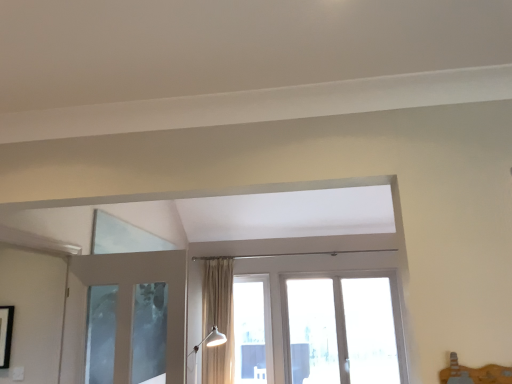
Where is `white glossy floor lamp at lower center`? This screenshot has width=512, height=384. white glossy floor lamp at lower center is located at coordinates (211, 340).

The width and height of the screenshot is (512, 384). What do you see at coordinates (211, 340) in the screenshot?
I see `white glossy floor lamp at lower center` at bounding box center [211, 340].

You are a GUI agent. You are given a task and a screenshot of the screen. Output one action in this format:
    pyautogui.click(x=<x>, y=<y>)
    Task: Click on the clear glass window at center
    
    Given the screenshot: What is the action you would take?
    pyautogui.click(x=253, y=329)

At what (x,y) coordinates should I click in order to perform the action: click on beige fabric curtain at center. Please return your answer as a coordinate pair (x, y). Looking at the image, I should click on (218, 320).

Which of these two, clear glass window at center or white glossy floor lamp at lower center, is wider?

With larger width is white glossy floor lamp at lower center.

Is clear glass window at center surrounding white glossy floor lamp at lower center?

Definitely not — white glossy floor lamp at lower center is not inside clear glass window at center.

Looking at this image, is clear glass window at center not near white glossy floor lamp at lower center?

Yes, clear glass window at center is far from white glossy floor lamp at lower center.

From the image's perspective, is white glossy floor lamp at lower center over clear glass window at center?

No, from the image's perspective, white glossy floor lamp at lower center is not over clear glass window at center.

What's the angular difference between white glossy floor lamp at lower center and clear glass window at center's facing directions?

The angular difference between white glossy floor lamp at lower center and clear glass window at center is 42.6 degrees.

Considering the sizes of white glossy floor lamp at lower center and clear glass window at center in the image, is white glossy floor lamp at lower center bigger or smaller than clear glass window at center?

Considering their sizes, white glossy floor lamp at lower center takes up more space than clear glass window at center.

Is white glossy floor lamp at lower center completely or partially outside of clear glass window at center?

Yes, white glossy floor lamp at lower center is outside of clear glass window at center.

Does beige fabric curtain at center have a greater width compared to white glossy floor lamp at lower center?

No.

Choose the correct answer: Is beige fabric curtain at center inside white glossy floor lamp at lower center or outside it?

beige fabric curtain at center is not inside white glossy floor lamp at lower center, it's outside.

Looking at this image, from the image's perspective, is beige fabric curtain at center on top of white glossy floor lamp at lower center?

Indeed, from the image's perspective, beige fabric curtain at center is shown above white glossy floor lamp at lower center.

Is beige fabric curtain at center further to the viewer compared to white glossy floor lamp at lower center?

Yes, beige fabric curtain at center is further from the camera.

In the scene shown: From a real-world perspective, which is physically below, beige fabric curtain at center or clear glass window at center?

In real-world perspective, clear glass window at center is lower.

Is beige fabric curtain at center touching clear glass window at center?

No, beige fabric curtain at center is not beside clear glass window at center.

Is beige fabric curtain at center positioned in front of clear glass window at center?

That is True.

Is beige fabric curtain at center looking in the opposite direction of clear glass window at center?

beige fabric curtain at center does not have its back to clear glass window at center.

Between white glossy floor lamp at lower center and beige fabric curtain at center, which one has larger size?

Bigger between the two is beige fabric curtain at center.

From the image's perspective, is white glossy floor lamp at lower center over beige fabric curtain at center?

No, from the image's perspective, white glossy floor lamp at lower center is not above beige fabric curtain at center.

From a real-world perspective, who is located lower, white glossy floor lamp at lower center or beige fabric curtain at center?

From a 3D spatial view, white glossy floor lamp at lower center is below.

Is white glossy floor lamp at lower center shorter than beige fabric curtain at center?

Indeed, white glossy floor lamp at lower center has a lesser height compared to beige fabric curtain at center.

Looking at their sizes, would you say clear glass window at center is wider or thinner than beige fabric curtain at center?

In the image, clear glass window at center appears to be more narrow than beige fabric curtain at center.

Which object is more forward, clear glass window at center or beige fabric curtain at center?

beige fabric curtain at center is more forward.

Is clear glass window at center to the left of beige fabric curtain at center from the viewer's perspective?

Incorrect, clear glass window at center is not on the left side of beige fabric curtain at center.

Locate an element on the screen. window behind the white glossy floor lamp at lower center is located at coordinates (253, 329).

Find the location of a particular element. Image resolution: width=512 pixels, height=384 pixels. window above the white glossy floor lamp at lower center (from a real-world perspective) is located at coordinates (253, 329).

Based on their spatial positions, is white glossy floor lamp at lower center or beige fabric curtain at center closer to clear glass window at center?

Among the two, beige fabric curtain at center is located nearer to clear glass window at center.

Looking at the image, which one is located closer to beige fabric curtain at center, white glossy floor lamp at lower center or clear glass window at center?

The object closer to beige fabric curtain at center is white glossy floor lamp at lower center.

When comparing their distances from beige fabric curtain at center, does clear glass window at center or white glossy floor lamp at lower center seem closer?

white glossy floor lamp at lower center.

From the image, which object appears to be nearer to white glossy floor lamp at lower center, clear glass window at center or beige fabric curtain at center?

beige fabric curtain at center lies closer to white glossy floor lamp at lower center than the other object.

From the picture: Looking at the image, which one is located further to white glossy floor lamp at lower center, beige fabric curtain at center or clear glass window at center?

Based on the image, clear glass window at center appears to be further to white glossy floor lamp at lower center.

Looking at the image, which one is located further to clear glass window at center, beige fabric curtain at center or white glossy floor lamp at lower center?

white glossy floor lamp at lower center lies further to clear glass window at center than the other object.

Locate an element on the screen. The width and height of the screenshot is (512, 384). curtain located between white glossy floor lamp at lower center and clear glass window at center in the depth direction is located at coordinates (218, 320).